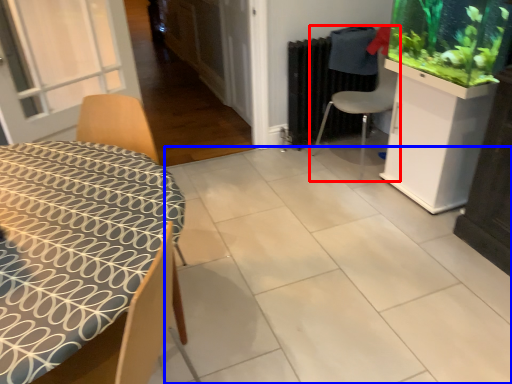
Question: Which of the following is the farthest to the observer, chair (highlighted by a red box) or tile (highlighted by a blue box)?

Choices:
 (A) chair
 (B) tile

Answer: (A)